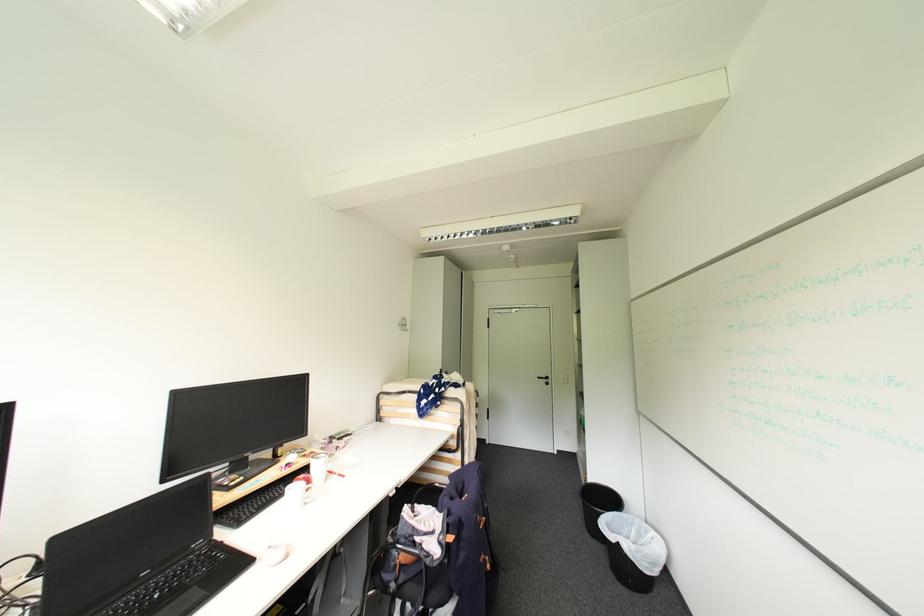
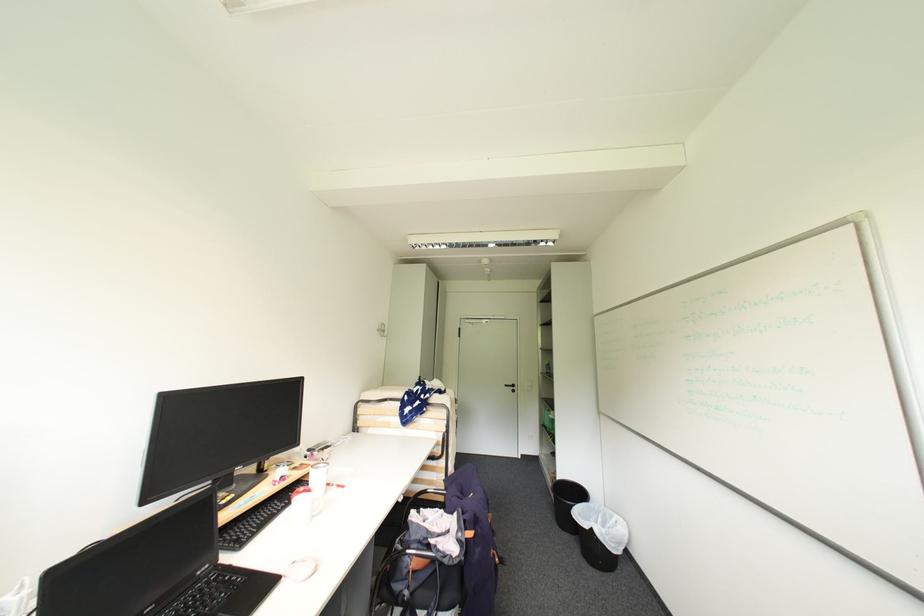
In the second image, find the point that corresponds to (300,488) in the first image.

(305, 501)